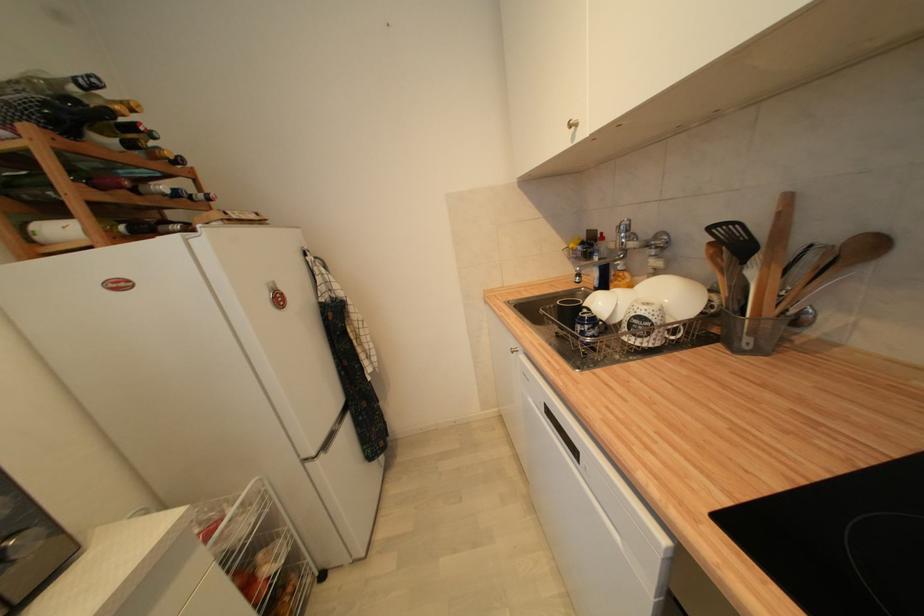
Find where to turn the faucet handle. Please return your answer as a coordinate pair (x, y).

(625, 236)